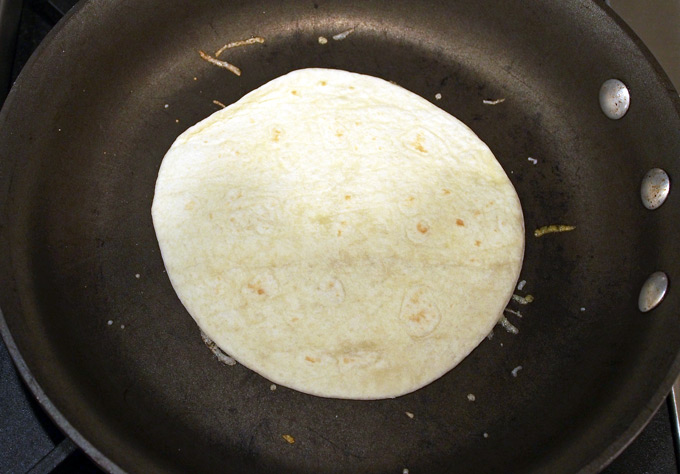
Identify the location of edge of the pan. (60, 425).